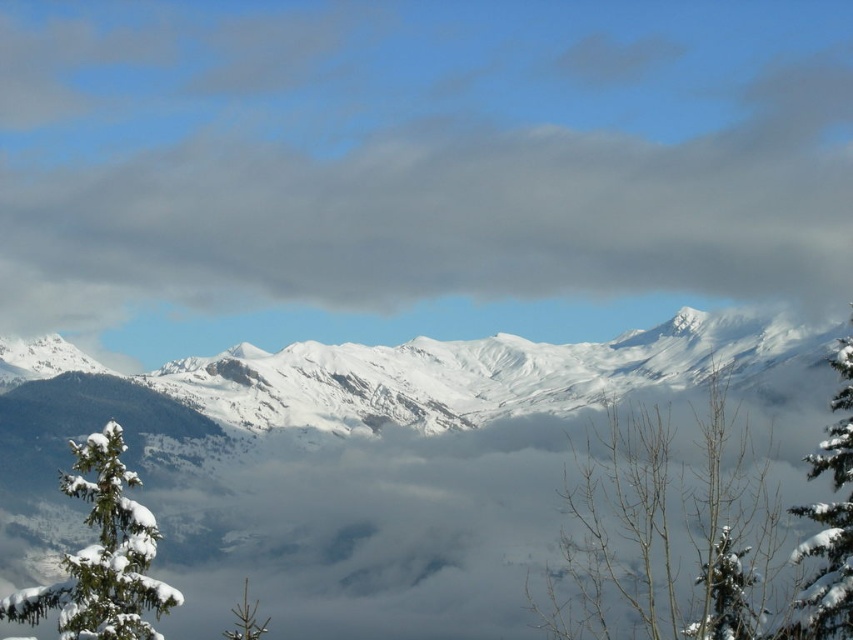
Question: Can you confirm if white snow-covered mountain range at center is bigger than snow-covered branches at center?

Choices:
 (A) no
 (B) yes

Answer: (B)

Question: Which point is farther from the camera taking this photo?

Choices:
 (A) (474, 426)
 (B) (363, 154)
 (C) (657, 493)

Answer: (B)

Question: Which point is farther to the camera?

Choices:
 (A) snow-covered branches at center
 (B) cloudy sky at upper center

Answer: (B)

Question: In this image, where is cloudy sky at upper center located relative to snow-covered branches at center?

Choices:
 (A) right
 (B) left

Answer: (B)

Question: Which of the following is the closest to the observer?

Choices:
 (A) (236, 632)
 (B) (598, 616)
 (C) (131, 524)

Answer: (C)

Question: Does snow-covered branches at center have a greater width compared to green matte tree at lower left?

Choices:
 (A) yes
 (B) no

Answer: (A)